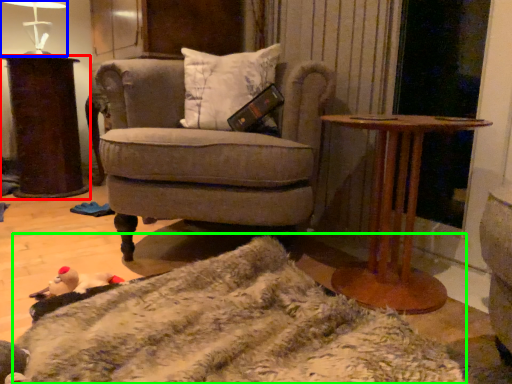
Question: Which is nearer to the desk (highlighted by a red box)? table lamp (highlighted by a blue box) or blanket (highlighted by a green box).

Choices:
 (A) table lamp
 (B) blanket

Answer: (A)